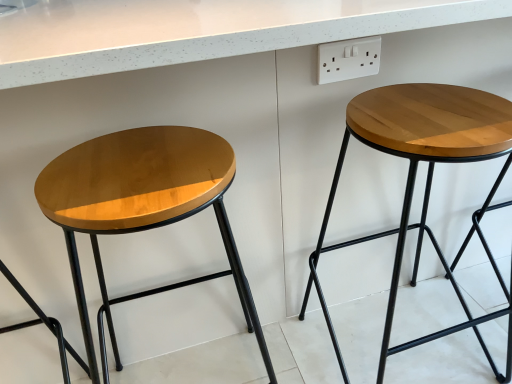
Find the location of a particular element. unoccupied area in front of white plastic socket at upper right is located at coordinates (399, 111).